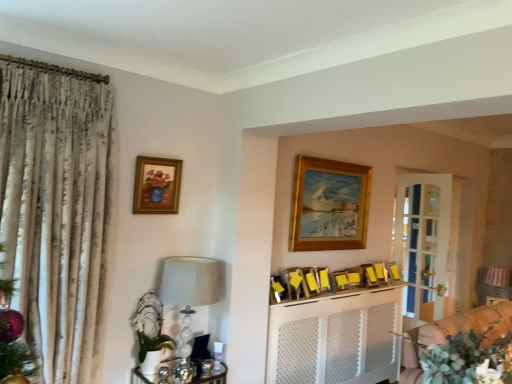
Question: Is wooden picture frame at center, placed as the 3th picture frame when sorted from right to left, far from wooden picture frame at center, which is the 4th picture frame in left-to-right order?

Choices:
 (A) yes
 (B) no

Answer: (B)

Question: Is wooden picture frame at center, placed as the 3th picture frame when sorted from right to left, at the left side of wooden picture frame at center, the sixth picture frame from the right?

Choices:
 (A) no
 (B) yes

Answer: (A)

Question: Considering the relative positions of wooden picture frame at center, marked as the seventh picture frame in a left-to-right arrangement, and wooden picture frame at center, which is the 4th picture frame in left-to-right order, in the image provided, is wooden picture frame at center, marked as the seventh picture frame in a left-to-right arrangement, to the right of wooden picture frame at center, which is the 4th picture frame in left-to-right order, from the viewer's perspective?

Choices:
 (A) no
 (B) yes

Answer: (B)

Question: Can we say wooden picture frame at center, placed as the 3th picture frame when sorted from right to left, lies outside wooden picture frame at center, which is the 4th picture frame in left-to-right order?

Choices:
 (A) no
 (B) yes

Answer: (B)

Question: From a real-world perspective, does wooden picture frame at center, marked as the seventh picture frame in a left-to-right arrangement, sit lower than wooden picture frame at center, the sixth picture frame from the right?

Choices:
 (A) yes
 (B) no

Answer: (A)

Question: Is wooden picture frame at center, placed as the 3th picture frame when sorted from right to left, next to wooden picture frame at center, the sixth picture frame from the right?

Choices:
 (A) yes
 (B) no

Answer: (B)

Question: Considering the relative positions of yellow paper at center, positioned as the 7th picture frame in right-to-left order, and yellow paper at center, the 2th picture frame viewed from the left, in the image provided, is yellow paper at center, positioned as the 7th picture frame in right-to-left order, to the left of yellow paper at center, the 2th picture frame viewed from the left, from the viewer's perspective?

Choices:
 (A) no
 (B) yes

Answer: (A)

Question: Is yellow paper at center, placed as the 3th picture frame when sorted from left to right, looking in the opposite direction of yellow paper at center, positioned as the eighth picture frame in right-to-left order?

Choices:
 (A) yes
 (B) no

Answer: (B)

Question: Can you confirm if yellow paper at center, positioned as the 7th picture frame in right-to-left order, is smaller than yellow paper at center, the 2th picture frame viewed from the left?

Choices:
 (A) yes
 (B) no

Answer: (B)

Question: Considering the relative sizes of yellow paper at center, positioned as the 7th picture frame in right-to-left order, and yellow paper at center, positioned as the eighth picture frame in right-to-left order, in the image provided, is yellow paper at center, positioned as the 7th picture frame in right-to-left order, taller than yellow paper at center, positioned as the eighth picture frame in right-to-left order,?

Choices:
 (A) yes
 (B) no

Answer: (A)

Question: Is yellow paper at center, positioned as the 7th picture frame in right-to-left order, to the right of yellow paper at center, positioned as the eighth picture frame in right-to-left order, from the viewer's perspective?

Choices:
 (A) no
 (B) yes

Answer: (B)

Question: Is yellow paper at center, placed as the 3th picture frame when sorted from left to right, oriented towards yellow paper at center, positioned as the eighth picture frame in right-to-left order?

Choices:
 (A) no
 (B) yes

Answer: (A)

Question: From a real-world perspective, does wooden picture frame at center, placed as the 3th picture frame when sorted from right to left, stand above white perforated cabinet at center?

Choices:
 (A) yes
 (B) no

Answer: (A)